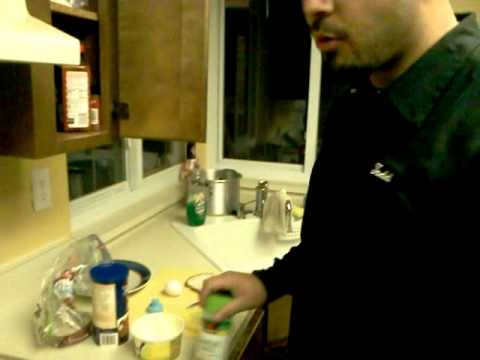
The image size is (480, 360). What are the coordinates of `plate` in the screenshot? It's located at (142, 273).